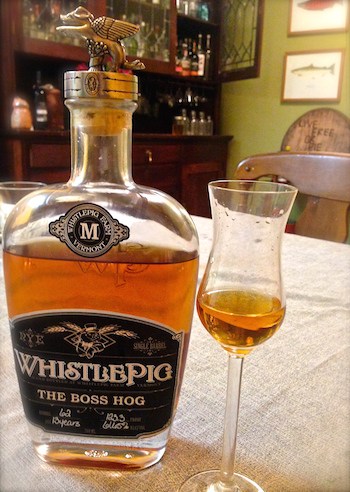
At what (x,y) coordinates should I click in order to perform the action: click on opened cabinet. Please return your answer as a coordinate pair (x, y). Looking at the image, I should click on (238, 43).